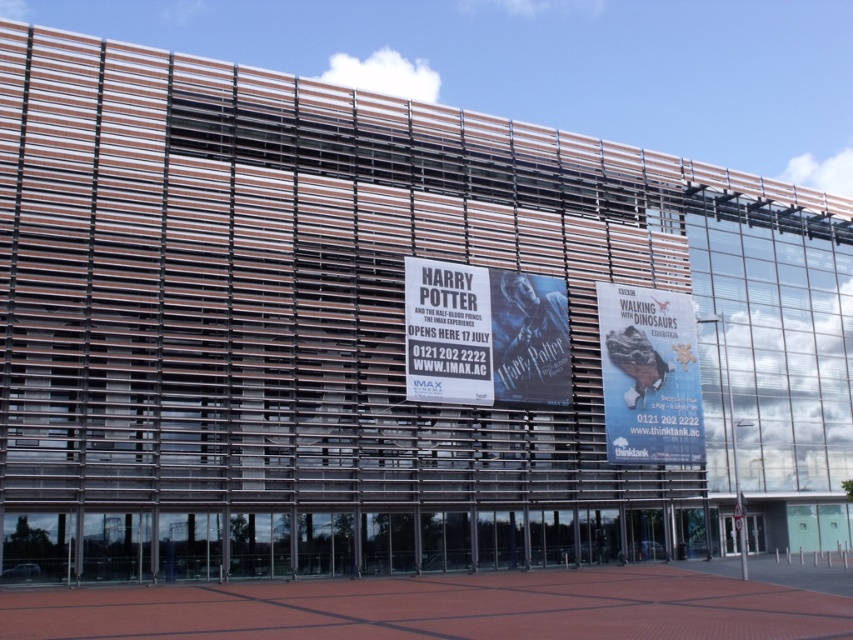
You are standing in front of the modern building and notice two points marked on its facade. The first point is at coordinates point (639, 308) and the second is at point (415, 305). Which point is closer to you?

Point (639, 308) is further to the viewer than point (415, 305), so the second point is closer to you.

Consider the image. You are standing in front of the modern building described. You want to read the text on the white paper billboard at center. Given that the average human can read text from 20 meters away, will you be able to read it clearly from your current position?

The white paper billboard at center is 51.50 meters away from the viewer, which is beyond the average human reading distance of 20 meters. Therefore, you will not be able to read it clearly from your current position.